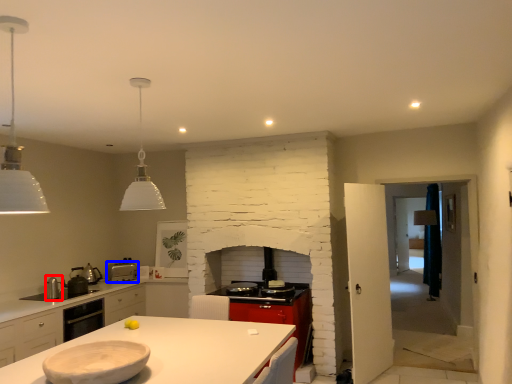
Question: Which point is further to the camera, appliance (highlighted by a red box) or kitchen appliance (highlighted by a blue box)?

Choices:
 (A) appliance
 (B) kitchen appliance

Answer: (B)